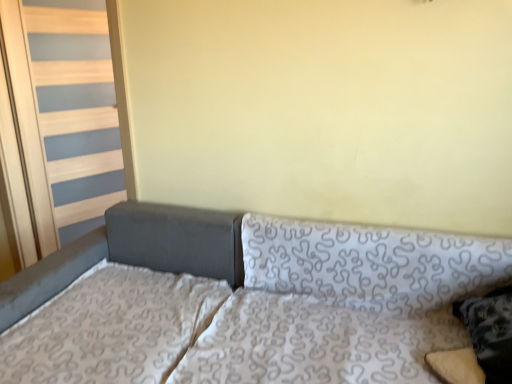
What do you see at coordinates (490, 332) in the screenshot? This screenshot has width=512, height=384. I see `patterned fabric pillow at right` at bounding box center [490, 332].

This screenshot has width=512, height=384. Find the location of `patterned fabric studio couch at center`. patterned fabric studio couch at center is located at coordinates tap(243, 303).

This screenshot has width=512, height=384. I want to click on patterned fabric pillow at right, so click(x=490, y=332).

Which is nearer, (127,354) or (507,297)?

Point (127,354) is farther from the camera than point (507,297).

Is patterned fabric mattress at lower left not within patterned fabric pillow at right?

Yes, patterned fabric mattress at lower left is outside of patterned fabric pillow at right.

Which object is positioned more to the left, patterned fabric mattress at lower left or patterned fabric pillow at right?

patterned fabric mattress at lower left is more to the left.

Based on the photo, are patterned fabric mattress at lower left and patterned fabric pillow at right far apart?

Yes, patterned fabric mattress at lower left is far from patterned fabric pillow at right.

From the image's perspective, which is above, patterned fabric studio couch at center or patterned fabric mattress at lower left?

From the image's view, patterned fabric mattress at lower left is above.

From the picture: How many degrees apart are the facing directions of patterned fabric studio couch at center and patterned fabric mattress at lower left?

1.04e-05 degrees separate the facing orientations of patterned fabric studio couch at center and patterned fabric mattress at lower left.

I want to click on studio couch in front of the patterned fabric mattress at lower left, so (243, 303).

From the image's perspective, is patterned fabric mattress at lower left located above patterned fabric studio couch at center?

Yes, from the image's perspective, patterned fabric mattress at lower left is above patterned fabric studio couch at center.

Who is smaller, patterned fabric mattress at lower left or patterned fabric studio couch at center?

patterned fabric mattress at lower left is smaller.

Image resolution: width=512 pixels, height=384 pixels. Find the location of `studio couch that is on the right side of patterned fabric mattress at lower left`. studio couch that is on the right side of patterned fabric mattress at lower left is located at coordinates (x=243, y=303).

Which object is closer to the camera taking this photo, patterned fabric mattress at lower left or patterned fabric studio couch at center?

patterned fabric studio couch at center is more forward.

Considering the sizes of objects patterned fabric pillow at right and patterned fabric mattress at lower left in the image provided, who is thinner, patterned fabric pillow at right or patterned fabric mattress at lower left?

Thinner between the two is patterned fabric pillow at right.

Who is taller, patterned fabric pillow at right or patterned fabric mattress at lower left?

patterned fabric pillow at right.

How far apart are patterned fabric pillow at right and patterned fabric mattress at lower left?

The distance of patterned fabric pillow at right from patterned fabric mattress at lower left is 3.80 feet.

Considering their positions, is patterned fabric pillow at right located in front of or behind patterned fabric mattress at lower left?

In the image, patterned fabric pillow at right appears in front of patterned fabric mattress at lower left.

Is patterned fabric studio couch at center far away from patterned fabric pillow at right?

That's not correct — patterned fabric studio couch at center is a little close to patterned fabric pillow at right.

Considering the sizes of objects patterned fabric studio couch at center and patterned fabric pillow at right in the image provided, who is bigger, patterned fabric studio couch at center or patterned fabric pillow at right?

Bigger between the two is patterned fabric studio couch at center.

Can you tell me how much patterned fabric studio couch at center and patterned fabric pillow at right differ in facing direction?

86 degrees separate the facing orientations of patterned fabric studio couch at center and patterned fabric pillow at right.

Which is more to the left, patterned fabric studio couch at center or patterned fabric pillow at right?

Positioned to the left is patterned fabric studio couch at center.

How different are the orientations of patterned fabric pillow at right and patterned fabric studio couch at center in degrees?

The angle between the facing direction of patterned fabric pillow at right and the facing direction of patterned fabric studio couch at center is 86 degrees.

Considering the points (511, 341) and (315, 371), which point is in front, point (511, 341) or point (315, 371)?

The point (511, 341) is closer to the camera.

From the image's perspective, is patterned fabric pillow at right under patterned fabric studio couch at center?

No, from the image's perspective, patterned fabric pillow at right is not beneath patterned fabric studio couch at center.

Is patterned fabric studio couch at center at the back of patterned fabric pillow at right?

Yes, patterned fabric pillow at right is positioned with its back facing patterned fabric studio couch at center.

At what (x,y) coordinates should I click in order to perform the action: click on pillow positioned vertically above the patterned fabric mattress at lower left (from a real-world perspective). Please return your answer as a coordinate pair (x, y). This screenshot has width=512, height=384. Looking at the image, I should click on (490, 332).

In order to click on mattress located behind the patterned fabric studio couch at center in this screenshot , I will do `click(111, 328)`.

Consider the image. When comparing their distances from patterned fabric studio couch at center, does patterned fabric pillow at right or patterned fabric mattress at lower left seem further?

patterned fabric pillow at right.

Looking at this image, considering their positions, is patterned fabric mattress at lower left positioned closer to patterned fabric studio couch at center than patterned fabric pillow at right?

patterned fabric mattress at lower left is closer to patterned fabric studio couch at center.

From the image, which object appears to be nearer to patterned fabric pillow at right, patterned fabric mattress at lower left or patterned fabric studio couch at center?

patterned fabric studio couch at center lies closer to patterned fabric pillow at right than the other object.

Estimate the real-world distances between objects in this image. Which object is closer to patterned fabric mattress at lower left, patterned fabric studio couch at center or patterned fabric pillow at right?

patterned fabric studio couch at center.

From the image, which object appears to be nearer to patterned fabric mattress at lower left, patterned fabric pillow at right or patterned fabric studio couch at center?

patterned fabric studio couch at center lies closer to patterned fabric mattress at lower left than the other object.

When comparing their distances from patterned fabric pillow at right, does patterned fabric studio couch at center or patterned fabric mattress at lower left seem closer?

patterned fabric studio couch at center is positioned closer to the anchor patterned fabric pillow at right.

Image resolution: width=512 pixels, height=384 pixels. I want to click on studio couch situated between patterned fabric mattress at lower left and patterned fabric pillow at right from left to right, so click(x=243, y=303).